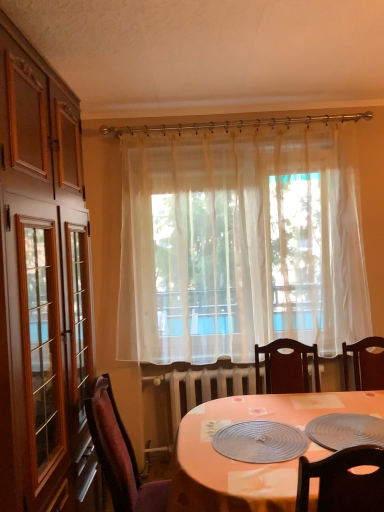
In order to click on vacant space situated on the left part of metallic textured platter at center, the 1th platter when ordered from left to right in this screenshot , I will do `click(197, 441)`.